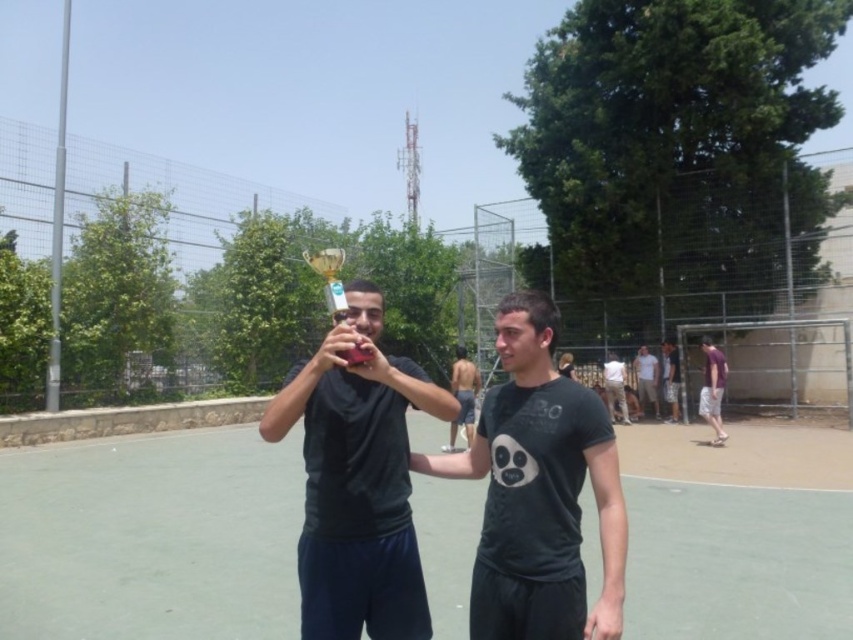
Question: Based on their relative distances, which object is nearer to the white cotton shirt at center?

Choices:
 (A) purple cotton shorts at right
 (B) khaki cotton pants at center
 (C) shiny metallic trophy at center
 (D) black matte t-shirt at center

Answer: (B)

Question: Is matte black trophy at center positioned in front of dark gray t-shirt at center?

Choices:
 (A) yes
 (B) no

Answer: (A)

Question: Does green rubber tennis court at center appear under matte pink phone at center?

Choices:
 (A) yes
 (B) no

Answer: (A)

Question: Is white cotton shirt at center smaller than matte pink phone at center?

Choices:
 (A) yes
 (B) no

Answer: (B)

Question: Among these objects, which one is farthest from the camera?

Choices:
 (A) purple cotton shorts at right
 (B) white cotton shirt at center
 (C) black matte t-shirt at center

Answer: (B)

Question: Estimate the real-world distances between objects in this image. Which object is closer to the gold metallic trophy at upper center?

Choices:
 (A) white cotton shirt at center
 (B) black matte t-shirt at center

Answer: (B)